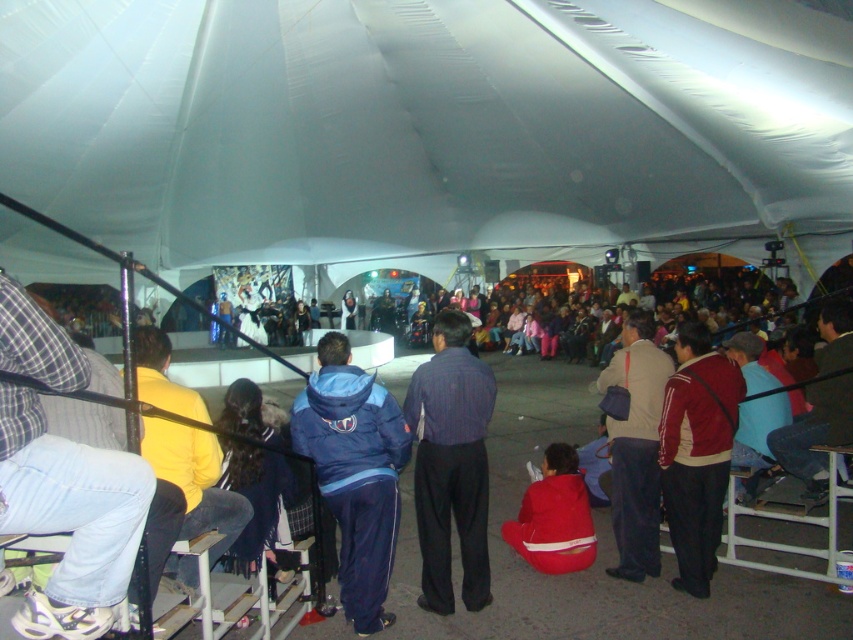
Question: Can you confirm if matte brown jacket at center is wider than red fabric jacket at center?

Choices:
 (A) no
 (B) yes

Answer: (A)

Question: Among these objects, which one is nearest to the camera?

Choices:
 (A) blue track suit at center
 (B) white fabric tent at center
 (C) denim pants at left

Answer: (C)

Question: Can you confirm if red jacket at center is positioned to the left of yellow fabric jacket at left?

Choices:
 (A) no
 (B) yes

Answer: (A)

Question: Which of the following is the closest to the observer?

Choices:
 (A) matte brown jacket at center
 (B) blue track suit at center
 (C) yellow fabric jacket at left
 (D) red jacket at center

Answer: (C)

Question: Which object is closer to the camera taking this photo?

Choices:
 (A) red jacket at center
 (B) red fabric jacket at center

Answer: (A)

Question: In this image, where is white fabric tent at center located relative to blue fleece jacket at center?

Choices:
 (A) left
 (B) right

Answer: (A)